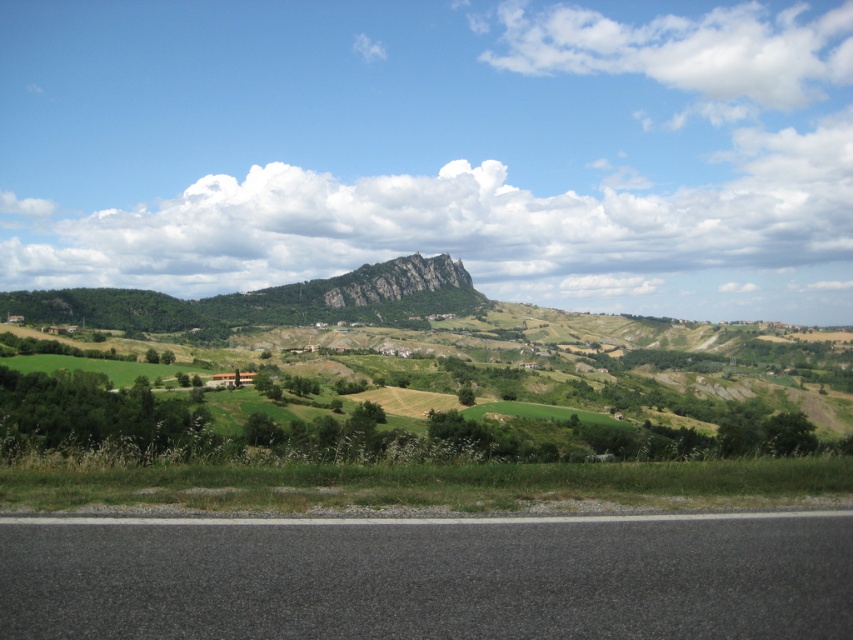
Question: Which point is farther from the camera taking this photo?

Choices:
 (A) (183, 252)
 (B) (816, 64)
 (C) (418, 308)

Answer: (B)

Question: Which of these objects is positioned closest to the white fluffy cloud at center?

Choices:
 (A) rugged stone mountain at center
 (B) white fluffy cloud at upper center

Answer: (B)

Question: Considering the relative positions of white fluffy cloud at center and white fluffy cloud at upper center in the image provided, where is white fluffy cloud at center located with respect to white fluffy cloud at upper center?

Choices:
 (A) below
 (B) above

Answer: (A)

Question: Observing the image, what is the correct spatial positioning of white fluffy cloud at center in reference to white fluffy cloud at upper center?

Choices:
 (A) above
 (B) below

Answer: (B)

Question: Observing the image, what is the correct spatial positioning of white fluffy cloud at center in reference to rugged stone mountain at center?

Choices:
 (A) right
 (B) left

Answer: (A)

Question: Which of these objects is positioned farthest from the white fluffy cloud at center?

Choices:
 (A) white fluffy cloud at upper center
 (B) rugged stone mountain at center

Answer: (B)